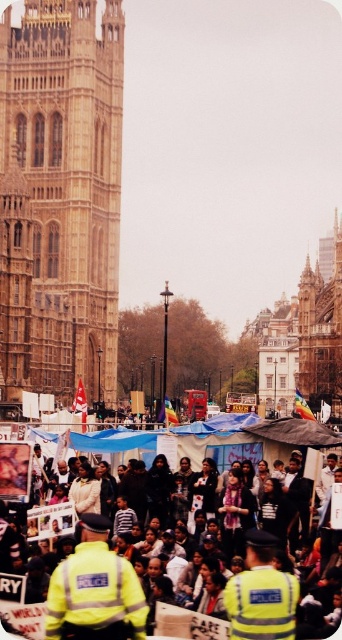
Based on the photo, you are a photographer standing at the edge of the crowd in the city square. You want to take a photo that includes both the reflective yellow jacket at lower left and the yellow reflective vests at center. Given that your camera has a maximum zoom range that can capture objects up to 6 meters apart, will you be able to fit both subjects in the same frame without moving closer?

The reflective yellow jacket at lower left and yellow reflective vests at center are 6.56 meters apart from each other. Since the maximum zoom can only capture up to 6 meters, the distance between them exceeds the camera capability. Therefore, you cannot fit both subjects in the same frame without moving closer.

You are a photographer standing in the city square and want to take a photo of the reflective yellow jacket at lower left. You notice a point at coordinates point (95, 589). Is this point located on the reflective yellow jacket at lower left?

Yes, the point (95, 589) is on the reflective yellow jacket at lower left according to the description.

You are a photographer trying to capture a photo of the golden stone tower at center while avoiding including the reflective yellow jacket at lower left in the frame. Given their sizes, is it possible to do so?

The golden stone tower at center is wider than the reflective yellow jacket at lower left, so it might be challenging to frame the tower without including the jacket if they are positioned closely. However, adjusting the camera angle or zoom could help isolate the tower if there is sufficient space between them.